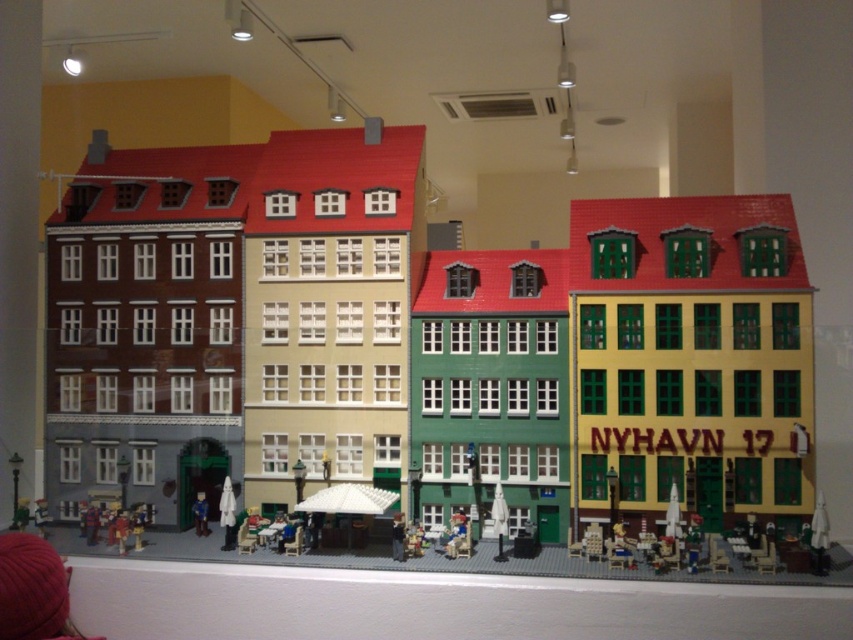
In the scene shown: Does smooth plastic chair at center appear on the right side of smooth plastic figure at center?

Correct, you'll find smooth plastic chair at center to the right of smooth plastic figure at center.

You are a GUI agent. You are given a task and a screenshot of the screen. Output one action in this format:
    pyautogui.click(x=<x>, y=<y>)
    Task: Click on the smooth plastic chair at center
    This screenshot has height=640, width=853.
    Given the screenshot: What is the action you would take?
    pyautogui.click(x=457, y=536)